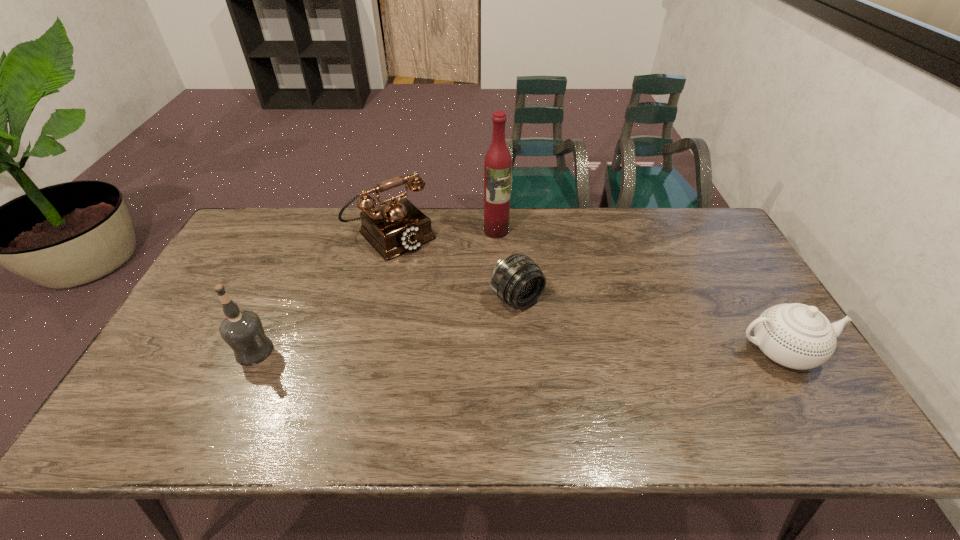
Locate an element on the screen. The width and height of the screenshot is (960, 540). telephone that is positioned at the far edge is located at coordinates (396, 226).

This screenshot has height=540, width=960. What are the coordinates of `object located in the near edge section of the desktop` in the screenshot? It's located at (798, 336).

I want to click on object located at the right edge, so click(798, 336).

The height and width of the screenshot is (540, 960). What are the coordinates of `object located at the near right corner` in the screenshot? It's located at (798, 336).

This screenshot has height=540, width=960. I want to click on vacant space at the far edge, so click(642, 245).

This screenshot has width=960, height=540. I want to click on vacant space at the near edge of the desktop, so coord(242,383).

What are the coordinates of `vacant space at the left edge` in the screenshot? It's located at (263, 268).

This screenshot has width=960, height=540. In order to click on vacant space at the far right corner in this screenshot , I will do click(x=698, y=217).

Identify the location of vacant space that's between the telephoto lens and the fourth object from right to left. (454, 267).

You are a GUI agent. You are given a task and a screenshot of the screen. Output one action in this format:
    pyautogui.click(x=<x>, y=<y>)
    Task: Click on the empty space that is in between the rightmost object and the vodka
    
    Given the screenshot: What is the action you would take?
    pyautogui.click(x=516, y=351)